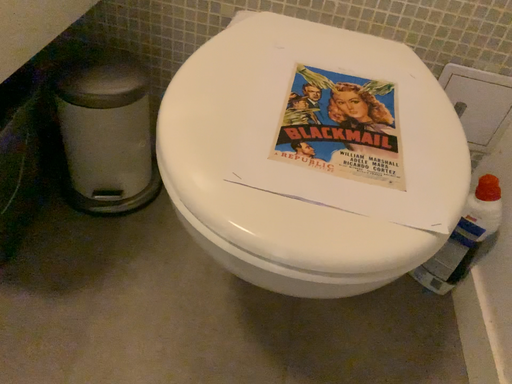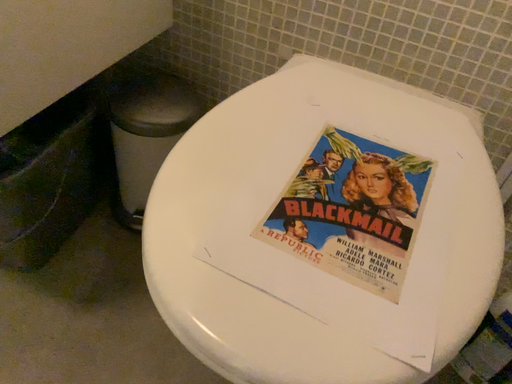
Question: Which way did the camera rotate in the video?

Choices:
 (A) rotated right
 (B) rotated left

Answer: (B)